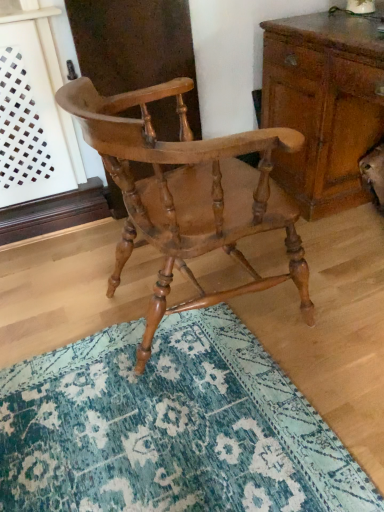
Question: Can you confirm if light brown wood chair at center is wider than teal textured rug at center?

Choices:
 (A) yes
 (B) no

Answer: (B)

Question: Considering the relative sizes of light brown wood chair at center and teal textured rug at center in the image provided, is light brown wood chair at center shorter than teal textured rug at center?

Choices:
 (A) yes
 (B) no

Answer: (B)

Question: Is light brown wood chair at center taller than teal textured rug at center?

Choices:
 (A) yes
 (B) no

Answer: (A)

Question: Is light brown wood chair at center far away from teal textured rug at center?

Choices:
 (A) yes
 (B) no

Answer: (B)

Question: From a real-world perspective, is light brown wood chair at center below teal textured rug at center?

Choices:
 (A) no
 (B) yes

Answer: (A)

Question: Is light brown wood chair at center oriented away from teal textured rug at center?

Choices:
 (A) yes
 (B) no

Answer: (B)

Question: Is wooden chest of drawers at right next to light brown wood chair at center?

Choices:
 (A) yes
 (B) no

Answer: (B)

Question: Is light brown wood chair at center located within wooden chest of drawers at right?

Choices:
 (A) yes
 (B) no

Answer: (B)

Question: Does wooden chest of drawers at right have a greater height compared to light brown wood chair at center?

Choices:
 (A) no
 (B) yes

Answer: (A)

Question: Is wooden chest of drawers at right aimed at light brown wood chair at center?

Choices:
 (A) no
 (B) yes

Answer: (B)

Question: Considering the relative sizes of wooden chest of drawers at right and light brown wood chair at center in the image provided, is wooden chest of drawers at right thinner than light brown wood chair at center?

Choices:
 (A) yes
 (B) no

Answer: (B)

Question: From the image's perspective, is wooden chest of drawers at right beneath light brown wood chair at center?

Choices:
 (A) yes
 (B) no

Answer: (B)

Question: Is teal textured rug at center further to camera compared to light brown wood chair at center?

Choices:
 (A) yes
 (B) no

Answer: (B)